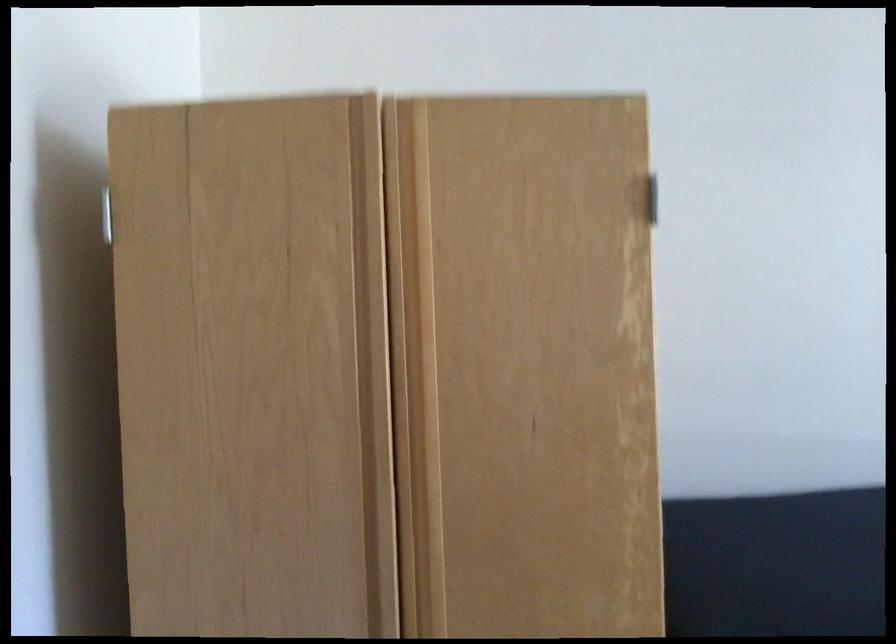
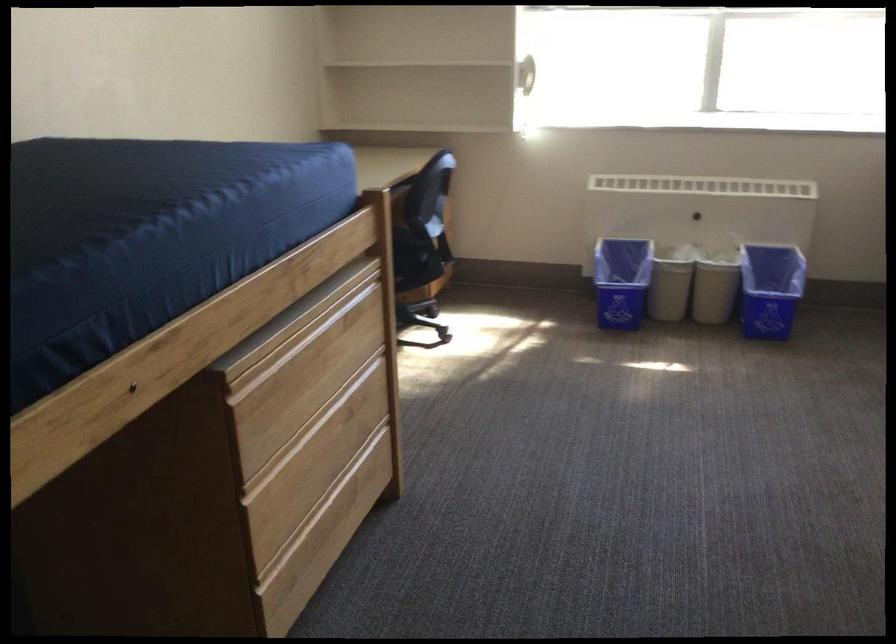
First-person continuous shooting, in which direction is the camera rotating?

The camera rotated toward right-down.